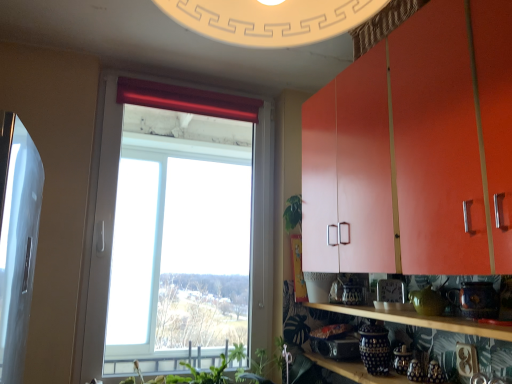
What are the coordinates of `green leafy plant at lower center, the 2th plant viewed from the left` in the screenshot? It's located at (264, 364).

The height and width of the screenshot is (384, 512). What do you see at coordinates (264, 364) in the screenshot? I see `green leafy plant at lower center, the 2th plant viewed from the left` at bounding box center [264, 364].

This screenshot has height=384, width=512. What are the coordinates of `blue and white ceramic jars at lower center, positioned as the 1th shelf in bottom-to-top order` in the screenshot? It's located at (357, 371).

How much space does blue and white ceramic jars at lower center, positioned as the 1th shelf in bottom-to-top order, occupy vertically?

7.19 centimeters.

Locate an element on the screen. This screenshot has height=384, width=512. transparent glass window at center is located at coordinates (179, 228).

In order to face green leafy plant at lower center, positioned as the 2th plant in right-to-left order, should I rotate leftwards or rightwards?

A 6.205 degree turn to the left will do.

Find the location of a particular element. green leafy plant at lower center, the 2th plant viewed from the left is located at coordinates (264, 364).

In the image, is wooden shelf at lower right, acting as the 2th shelf starting from the bottom, positioned in front of or behind matte orange cabinet at upper right?

In the image, wooden shelf at lower right, acting as the 2th shelf starting from the bottom, appears behind matte orange cabinet at upper right.

Looking at this image, who is shorter, wooden shelf at lower right, the first shelf in the top-to-bottom sequence, or matte orange cabinet at upper right?

With less height is wooden shelf at lower right, the first shelf in the top-to-bottom sequence.

From the image's perspective, is wooden shelf at lower right, acting as the 2th shelf starting from the bottom, below matte orange cabinet at upper right?

Yes, from the image's perspective, wooden shelf at lower right, acting as the 2th shelf starting from the bottom, is below matte orange cabinet at upper right.

Is wooden shelf at lower right, the first shelf in the top-to-bottom sequence, oriented away from matte orange cabinet at upper right?

No, wooden shelf at lower right, the first shelf in the top-to-bottom sequence, is not facing the opposite direction of matte orange cabinet at upper right.

In the scene shown: Considering the relative positions of blue and white ceramic jars at lower center, the 2th shelf in the top-to-bottom sequence, and transparent glass window at center in the image provided, is blue and white ceramic jars at lower center, the 2th shelf in the top-to-bottom sequence, to the left of transparent glass window at center from the viewer's perspective?

No, blue and white ceramic jars at lower center, the 2th shelf in the top-to-bottom sequence, is not to the left of transparent glass window at center.

Is blue and white ceramic jars at lower center, the 2th shelf in the top-to-bottom sequence, shorter than transparent glass window at center?

Indeed, blue and white ceramic jars at lower center, the 2th shelf in the top-to-bottom sequence, has a lesser height compared to transparent glass window at center.

From the image's perspective, between blue and white ceramic jars at lower center, positioned as the 1th shelf in bottom-to-top order, and transparent glass window at center, who is located below?

blue and white ceramic jars at lower center, positioned as the 1th shelf in bottom-to-top order.

Could you tell me if blue and white ceramic jars at lower center, positioned as the 1th shelf in bottom-to-top order, is facing transparent glass window at center?

No, blue and white ceramic jars at lower center, positioned as the 1th shelf in bottom-to-top order, is not oriented towards transparent glass window at center.

Can you confirm if wooden shelf at lower right, acting as the 2th shelf starting from the bottom, is taller than transparent glass window at center?

No, wooden shelf at lower right, acting as the 2th shelf starting from the bottom, is not taller than transparent glass window at center.

Is wooden shelf at lower right, acting as the 2th shelf starting from the bottom, touching transparent glass window at center?

No, wooden shelf at lower right, acting as the 2th shelf starting from the bottom, is not touching transparent glass window at center.

How much distance is there between wooden shelf at lower right, the first shelf in the top-to-bottom sequence, and transparent glass window at center?

wooden shelf at lower right, the first shelf in the top-to-bottom sequence, is 5.58 feet from transparent glass window at center.

Which is more to the right, wooden shelf at lower right, the first shelf in the top-to-bottom sequence, or transparent glass window at center?

wooden shelf at lower right, the first shelf in the top-to-bottom sequence, is more to the right.

Between green leafy plant at lower center, the 1th plant viewed from the right, and red velvet curtain at upper center, which one appears on the left side from the viewer's perspective?

red velvet curtain at upper center is more to the left.

Which of these two, green leafy plant at lower center, the 1th plant viewed from the right, or red velvet curtain at upper center, is bigger?

green leafy plant at lower center, the 1th plant viewed from the right, is bigger.

From the image's perspective, which one is positioned lower, green leafy plant at lower center, the 2th plant viewed from the left, or red velvet curtain at upper center?

From the image's view, green leafy plant at lower center, the 2th plant viewed from the left, is below.

The width and height of the screenshot is (512, 384). Find the location of `the 1st shelf in front when counting from the transparent glass window at center`. the 1st shelf in front when counting from the transparent glass window at center is located at coordinates (357, 371).

Is transparent glass window at center directly adjacent to blue and white ceramic jars at lower center, positioned as the 1th shelf in bottom-to-top order?

They are not placed beside each other.

How many degrees apart are the facing directions of transparent glass window at center and blue and white ceramic jars at lower center, the 2th shelf in the top-to-bottom sequence?

There is a 89.6-degree angle between the facing directions of transparent glass window at center and blue and white ceramic jars at lower center, the 2th shelf in the top-to-bottom sequence.

Could you tell me if transparent glass window at center is facing blue and white ceramic jars at lower center, positioned as the 1th shelf in bottom-to-top order?

No, transparent glass window at center is not turned towards blue and white ceramic jars at lower center, positioned as the 1th shelf in bottom-to-top order.

Can you confirm if matte orange cabinet at upper right is wider than red velvet curtain at upper center?

Yes.

Consider the image. From a real-world perspective, is matte orange cabinet at upper right positioned above or below red velvet curtain at upper center?

matte orange cabinet at upper right is below red velvet curtain at upper center.

Consider the image. Does matte orange cabinet at upper right lie in front of red velvet curtain at upper center?

Yes, it is.

Looking at this image, how different are the orientations of matte orange cabinet at upper right and red velvet curtain at upper center in degrees?

The angle between the facing direction of matte orange cabinet at upper right and the facing direction of red velvet curtain at upper center is 88.9 degrees.

In the scene shown: Does matte orange cabinet at upper right turn towards transparent glass window at center?

No, matte orange cabinet at upper right is not turned towards transparent glass window at center.

From the image's perspective, between matte orange cabinet at upper right and transparent glass window at center, who is located below?

transparent glass window at center.

What's the angular difference between matte orange cabinet at upper right and transparent glass window at center's facing directions?

The facing directions of matte orange cabinet at upper right and transparent glass window at center are 88.9 degrees apart.

This screenshot has height=384, width=512. What are the coordinates of `cabinetry above the transparent glass window at center (from a real-world perspective)` in the screenshot? It's located at (415, 149).

This screenshot has width=512, height=384. What are the coordinates of `cabinetry above the wooden shelf at lower right, the first shelf in the top-to-bottom sequence (from the image's perspective)` in the screenshot? It's located at (415, 149).

At what (x,y) coordinates should I click in order to perform the action: click on window lying on the left of blue and white ceramic jars at lower center, the 2th shelf in the top-to-bottom sequence. Please return your answer as a coordinate pair (x, y). Looking at the image, I should click on (179, 228).

Based on the photo, looking at the image, which one is located further to green leafy plant at lower center, the 2th plant viewed from the left, red velvet curtain at upper center or blue and white ceramic jars at lower center, positioned as the 1th shelf in bottom-to-top order?

red velvet curtain at upper center is further to green leafy plant at lower center, the 2th plant viewed from the left.

Which object lies nearer to the anchor point green leafy plant at lower center, positioned as the 2th plant in right-to-left order, blue and white ceramic jars at lower center, the 2th shelf in the top-to-bottom sequence, or red velvet curtain at upper center?

blue and white ceramic jars at lower center, the 2th shelf in the top-to-bottom sequence, is positioned closer to the anchor green leafy plant at lower center, positioned as the 2th plant in right-to-left order.

When comparing their distances from transparent glass window at center, does red velvet curtain at upper center or wooden shelf at lower right, acting as the 2th shelf starting from the bottom, seem closer?

red velvet curtain at upper center is positioned closer to the anchor transparent glass window at center.

When comparing their distances from matte orange cabinet at upper right, does green leafy plant at lower center, the 2th plant viewed from the left, or wooden shelf at lower right, the first shelf in the top-to-bottom sequence, seem further?

Based on the image, green leafy plant at lower center, the 2th plant viewed from the left, appears to be further to matte orange cabinet at upper right.

Based on the photo, from the image, which object appears to be farther from green leafy plant at lower center, the 2th plant viewed from the left, blue and white ceramic jars at lower center, the 2th shelf in the top-to-bottom sequence, or wooden shelf at lower right, the first shelf in the top-to-bottom sequence?

Among the two, wooden shelf at lower right, the first shelf in the top-to-bottom sequence, is located further to green leafy plant at lower center, the 2th plant viewed from the left.

Considering their positions, is blue and white ceramic jars at lower center, the 2th shelf in the top-to-bottom sequence, positioned further to green leafy plant at lower center, acting as the 1th plant starting from the left, than green leafy plant at lower center, the 1th plant viewed from the right?

Among the two, blue and white ceramic jars at lower center, the 2th shelf in the top-to-bottom sequence, is located further to green leafy plant at lower center, acting as the 1th plant starting from the left.

Based on their spatial positions, is matte orange cabinet at upper right or blue and white ceramic jars at lower center, positioned as the 1th shelf in bottom-to-top order, closer to green leafy plant at lower center, acting as the 1th plant starting from the left?

blue and white ceramic jars at lower center, positioned as the 1th shelf in bottom-to-top order, is positioned closer to the anchor green leafy plant at lower center, acting as the 1th plant starting from the left.

Considering their positions, is wooden shelf at lower right, the first shelf in the top-to-bottom sequence, positioned further to red velvet curtain at upper center than green leafy plant at lower center, the 2th plant viewed from the left?

The object further to red velvet curtain at upper center is green leafy plant at lower center, the 2th plant viewed from the left.

This screenshot has height=384, width=512. In order to click on window between matte orange cabinet at upper right and green leafy plant at lower center, acting as the 1th plant starting from the left, in the front-back direction in this screenshot , I will do `click(179, 228)`.

Where is `plant between transparent glass window at center and green leafy plant at lower center, acting as the 1th plant starting from the left, in the vertical direction`? plant between transparent glass window at center and green leafy plant at lower center, acting as the 1th plant starting from the left, in the vertical direction is located at coordinates (264, 364).

Where is `shelf between transparent glass window at center and wooden shelf at lower right, the first shelf in the top-to-bottom sequence, from left to right`? This screenshot has height=384, width=512. shelf between transparent glass window at center and wooden shelf at lower right, the first shelf in the top-to-bottom sequence, from left to right is located at coordinates (357, 371).

The width and height of the screenshot is (512, 384). Identify the location of window between red velvet curtain at upper center and green leafy plant at lower center, the 1th plant viewed from the right, in the vertical direction. (179, 228).